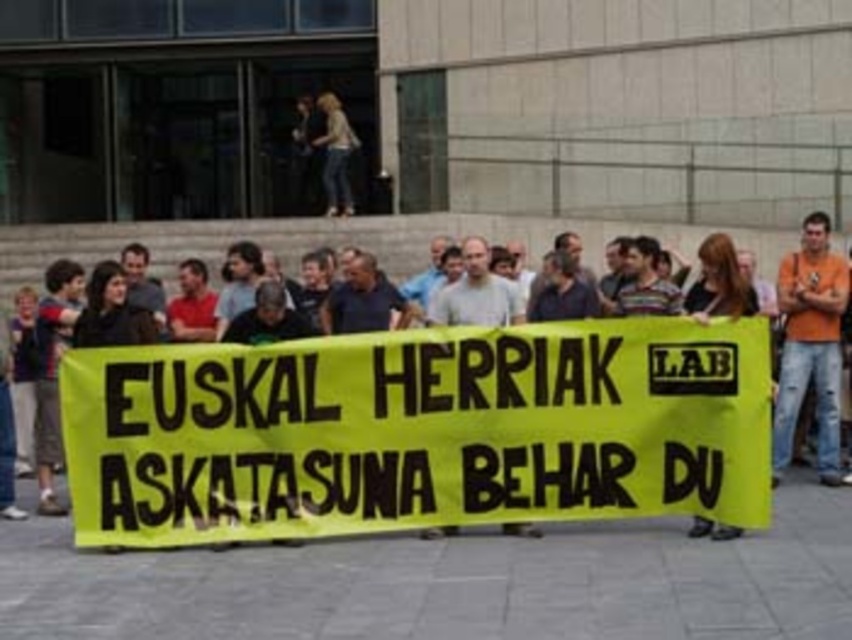
You are a photographer at the protest scene. You want to capture a photo where the yellow fabric banner at center is clearly visible without being blocked by the orange cotton shirt at right. Based on their positions, is this possible?

The yellow fabric banner at center is located above the orange cotton shirt at right, so positioning the camera to focus on the upper part of the scene would allow the banner to be visible without obstruction from the shirt.

You are a photographer trying to capture the yellow fabric banner at center and the matte black shirt at center in a single frame. Given that the banner is larger than the shirt, which object should you position closer to the camera to ensure both fit in the frame?

Since the yellow fabric banner at center is larger than the matte black shirt at center, you should position the matte black shirt at center closer to the camera to ensure both fit within the frame.

You are a photographer at the protest scene. You want to take a photo that includes both the orange cotton shirt at right and the matte black shirt at center. Which shirt will appear bigger in the photo?

The orange cotton shirt at right will appear bigger in the photo because it has a larger size compared to the matte black shirt at center.